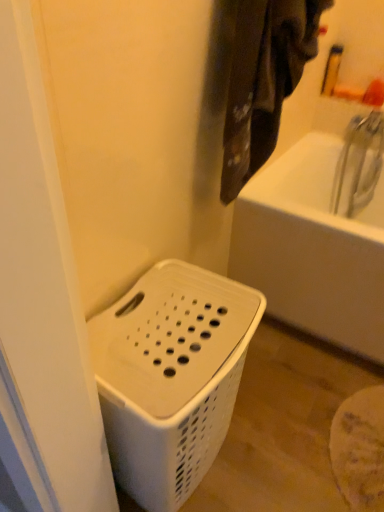
Question: From a real-world perspective, is white plastic laundry basket at upper right above or below white plastic basket at lower left?

Choices:
 (A) below
 (B) above

Answer: (B)

Question: Is point (248, 74) positioned closer to the camera than point (175, 488)?

Choices:
 (A) closer
 (B) farther

Answer: (A)

Question: Looking at their shapes, would you say white plastic laundry basket at upper right is wider or thinner than white plastic basket at lower left?

Choices:
 (A) thin
 (B) wide

Answer: (A)

Question: Is white plastic basket at lower left situated inside white plastic laundry basket at upper right or outside?

Choices:
 (A) outside
 (B) inside

Answer: (A)

Question: From the image's perspective, is white plastic basket at lower left located above or below white plastic laundry basket at upper right?

Choices:
 (A) below
 (B) above

Answer: (A)

Question: Considering the positions of point (185, 381) and point (276, 133), is point (185, 381) closer or farther from the camera than point (276, 133)?

Choices:
 (A) farther
 (B) closer

Answer: (B)

Question: Is white plastic basket at lower left bigger or smaller than white plastic laundry basket at upper right?

Choices:
 (A) small
 (B) big

Answer: (B)